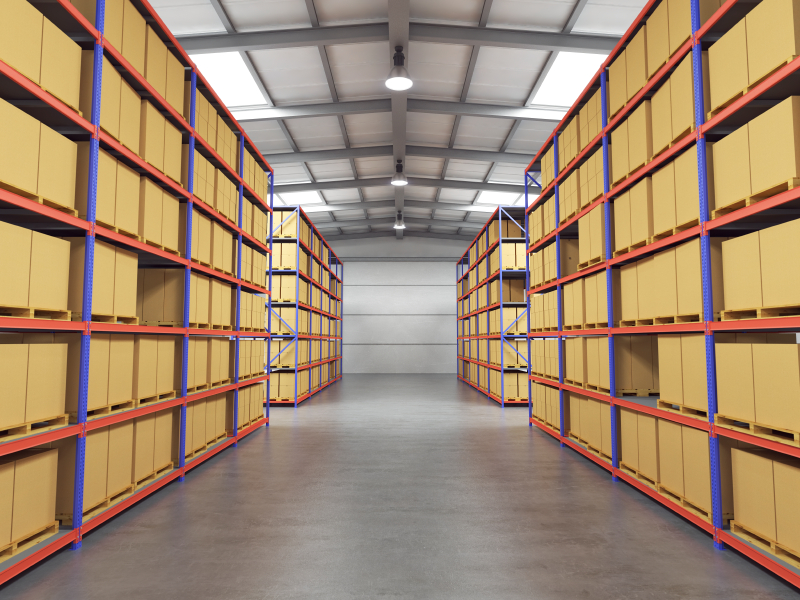
At what (x,y) coordinates should I click in order to perform the action: click on black part to secure lights to ceiling and silver globe unique. Please return your answer as a coordinate pair (x, y). Looking at the image, I should click on (398, 52), (400, 163), (398, 213), (398, 74), (401, 175), (398, 222).